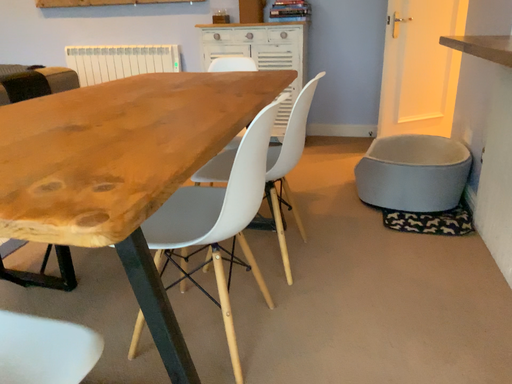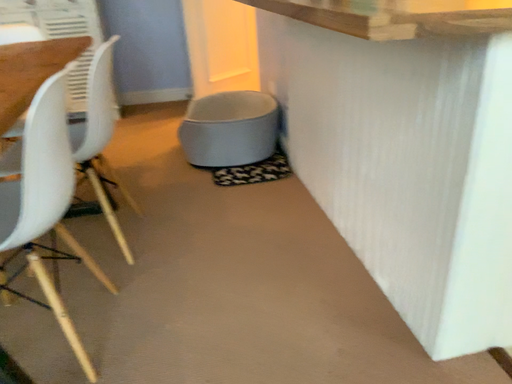
Question: Which way did the camera rotate in the video?

Choices:
 (A) rotated right
 (B) rotated left

Answer: (A)